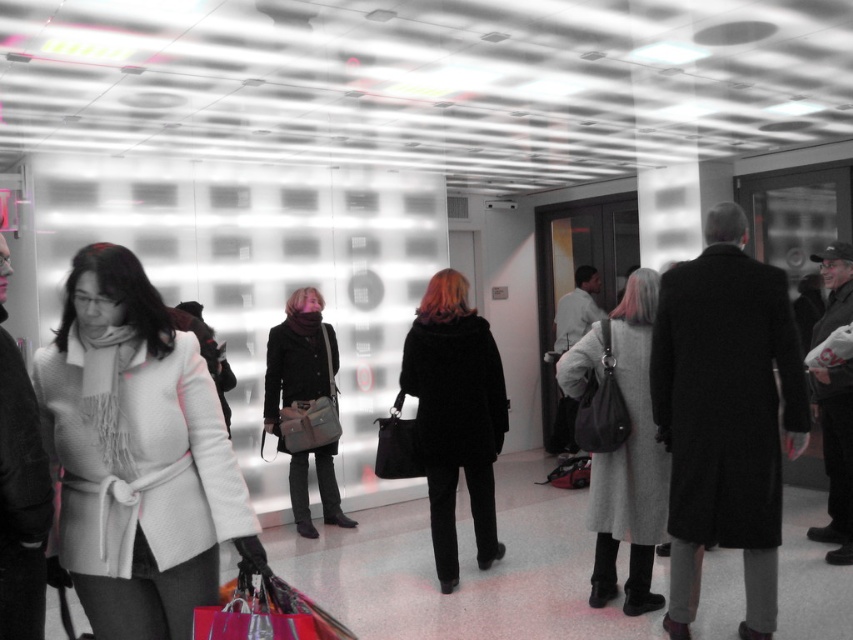
Question: Where is gray wool coat at center located in relation to black fur coat at center in the image?

Choices:
 (A) right
 (B) left

Answer: (A)

Question: Which object is closer to the camera taking this photo?

Choices:
 (A) white wool coat at center
 (B) black fur coat at center
 (C) gray wool coat at center

Answer: (A)

Question: Which point is farther to the camera?

Choices:
 (A) (175, 516)
 (B) (270, 346)

Answer: (B)

Question: Is white wool coat at center above black fur coat at center?

Choices:
 (A) yes
 (B) no

Answer: (A)

Question: Which of the following is the farthest from the observer?

Choices:
 (A) black fur coat at center
 (B) gray wool coat at center
 (C) matte black coat at center
 (D) white wool coat at center

Answer: (C)

Question: Does gray wool coat at center appear on the right side of black fur coat at center?

Choices:
 (A) yes
 (B) no

Answer: (A)